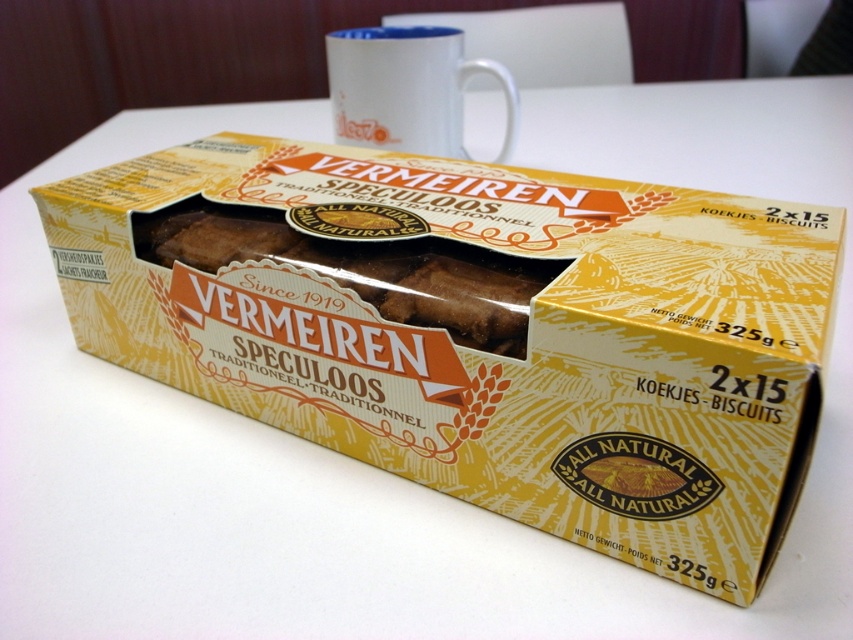
You are standing 2 meters away from the point at coordinates point (722, 502). If you move forward 1.5 meters, will you be closer to the point?

The distance between you and the point is initially 2 meters. After moving forward 1.5 meters, you will be 0.5 meters away from the point, so yes, you will be closer to the point.